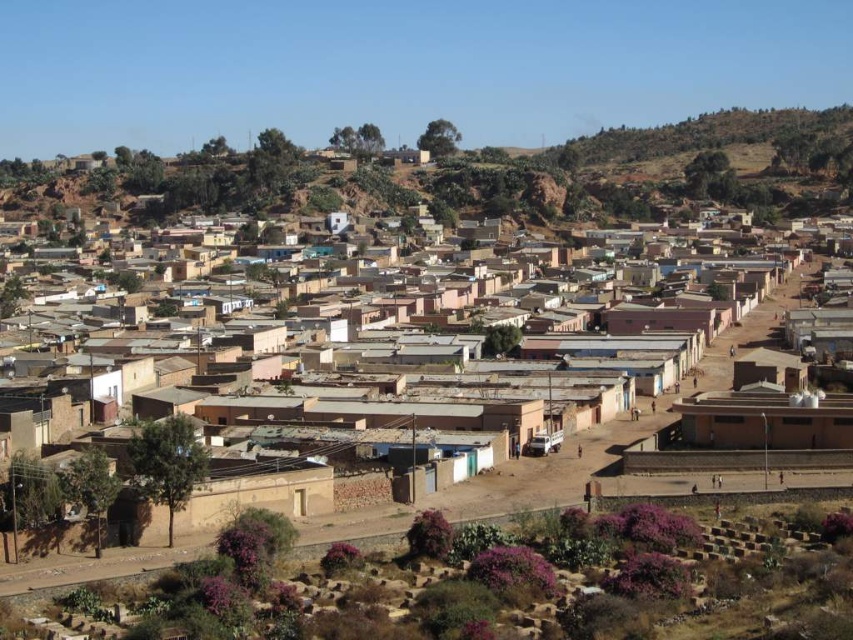
Question: Which point is farther to the camera?

Choices:
 (A) brown mud-brick houses at center
 (B) brown mud hut at lower left
 (C) brown clay hut at lower right

Answer: (C)

Question: Does brown mud hut at lower left have a lesser width compared to brown clay hut at lower right?

Choices:
 (A) no
 (B) yes

Answer: (B)

Question: Is brown mud hut at lower left smaller than brown clay hut at lower right?

Choices:
 (A) no
 (B) yes

Answer: (B)

Question: Which point is closer to the camera taking this photo?

Choices:
 (A) (601, 403)
 (B) (283, 500)
 (C) (834, 438)

Answer: (B)

Question: Which of the following is the closest to the observer?

Choices:
 (A) (293, 486)
 (B) (190, 500)

Answer: (B)

Question: Is brown mud hut at lower left to the right of brown clay hut at lower right from the viewer's perspective?

Choices:
 (A) no
 (B) yes

Answer: (A)